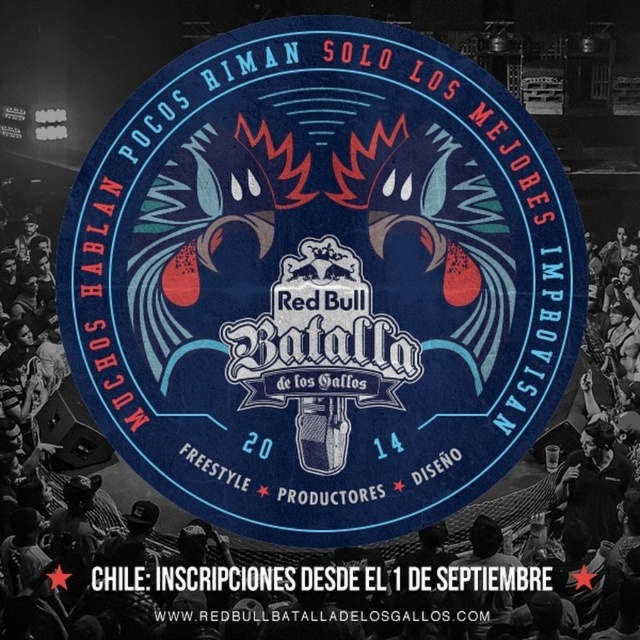
Question: Is matte blue circular at center to the left of black fabric crowd at center from the viewer's perspective?

Choices:
 (A) no
 (B) yes

Answer: (A)

Question: Can you confirm if matte blue circular at center is positioned below black fabric crowd at center?

Choices:
 (A) yes
 (B) no

Answer: (B)

Question: Where is matte blue circular at center located in relation to black fabric crowd at center in the image?

Choices:
 (A) below
 (B) above

Answer: (B)

Question: Which object is closer to the camera taking this photo?

Choices:
 (A) matte blue circular at center
 (B) black fabric crowd at center

Answer: (B)